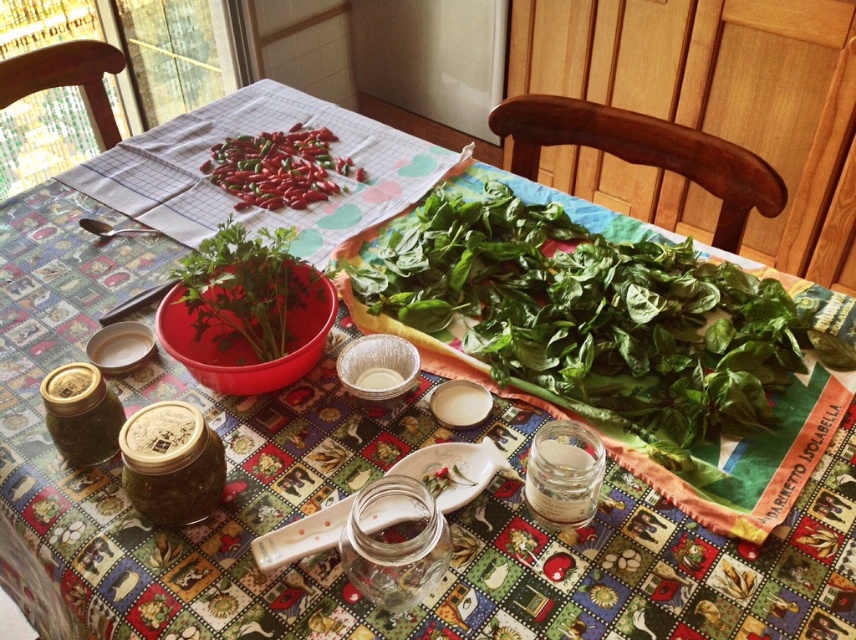
Looking at this image, who is shorter, green leafy plant at center or red matte chili peppers at center?

red matte chili peppers at center is shorter.

Who is positioned more to the left, green leafy plant at center or red matte chili peppers at center?

From the viewer's perspective, red matte chili peppers at center appears more on the left side.

Is point (218, 252) closer to camera compared to point (242, 179)?

Yes, it is in front of point (242, 179).

You are a GUI agent. You are given a task and a screenshot of the screen. Output one action in this format:
    pyautogui.click(x=<x>, y=<y>)
    Task: Click on the green leafy plant at center
    This screenshot has height=640, width=856.
    Given the screenshot: What is the action you would take?
    pyautogui.click(x=247, y=288)

Does green leafy vegetable at center have a greater height compared to green leafy plant at center?

Yes, green leafy vegetable at center is taller than green leafy plant at center.

What do you see at coordinates (593, 317) in the screenshot? The image size is (856, 640). I see `green leafy vegetable at center` at bounding box center [593, 317].

Does point (522, 200) lie behind point (198, 269)?

Yes, it is behind point (198, 269).

You are a GUI agent. You are given a task and a screenshot of the screen. Output one action in this format:
    pyautogui.click(x=<x>, y=<y>)
    Task: Click on the green leafy vegetable at center
    
    Given the screenshot: What is the action you would take?
    pyautogui.click(x=593, y=317)

Who is lower down, green leafy vegetable at center or red matte chili peppers at center?

Positioned lower is green leafy vegetable at center.

How much distance is there between green leafy vegetable at center and red matte chili peppers at center?

green leafy vegetable at center is 37.96 centimeters from red matte chili peppers at center.

Which is in front, point (581, 289) or point (308, 148)?

Point (581, 289) is in front.

The image size is (856, 640). I want to click on green leafy vegetable at center, so click(593, 317).